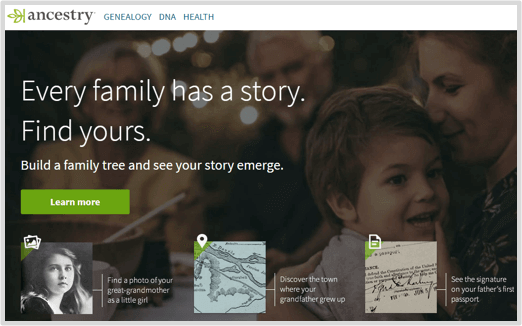
Locate an element on the screen. This screenshot has width=522, height=326. light source is located at coordinates (x=253, y=117), (x=201, y=104), (x=179, y=87), (x=143, y=51), (x=161, y=48), (x=179, y=48), (x=192, y=43), (x=209, y=39).